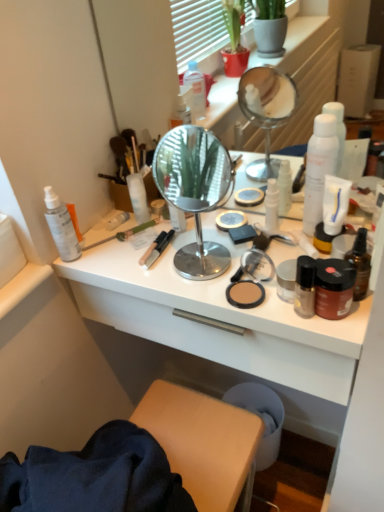
What are the coordinates of `free space on the front side of clear plastic tube at center, the third toiletry in the left-to-right sequence` in the screenshot? It's located at (127, 258).